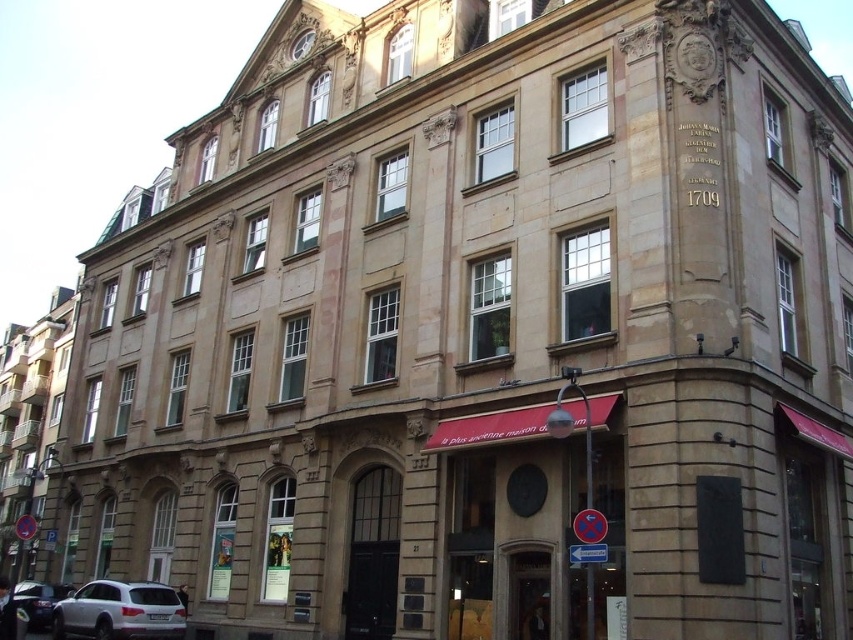
You are standing in front of the building and see both the white matte suv at lower left and the shiny silver car at lower left. From your perspective, which vehicle is positioned to the right of the other?

The white matte suv at lower left is to the right of the shiny silver car at lower left.

You are driving a car and want to park in the parking lot near the historical building. You see a white matte suv at lower left and a shiny silver car at lower left. Which car is blocking your path closer to you?

The white matte suv at lower left is closer to the viewer than the shiny silver car at lower left, so the white matte suv at lower left is blocking your path closer to you.